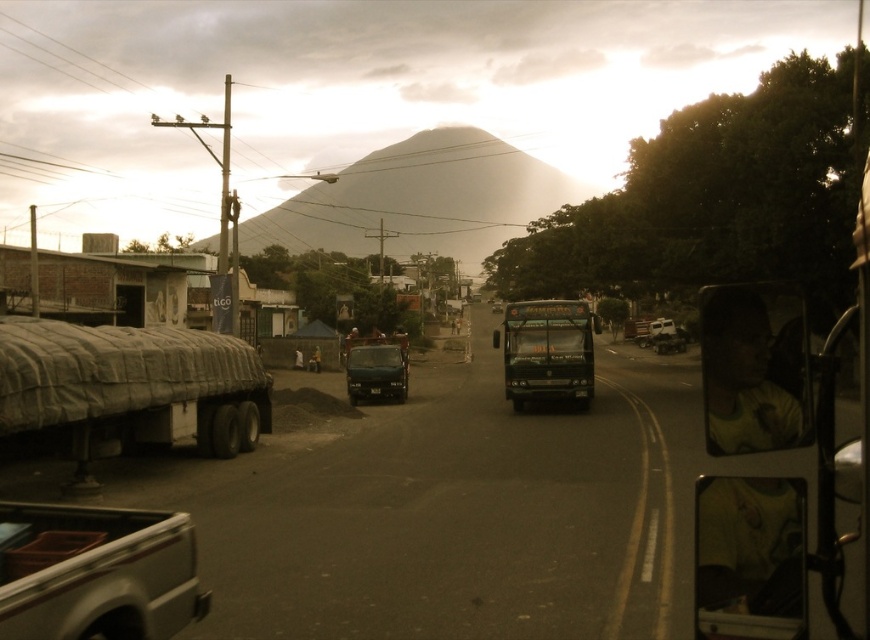
You are a delivery driver who needs to park your vehicle in a tight space between the white matte truck at lower left and the matte black truck at center. Based on their sizes, which truck should you avoid parking next to to ensure enough clearance?

The white matte truck at lower left is not as tall as the matte black truck at center, so you should avoid parking next to the matte black truck at center to ensure enough clearance because it is taller.

You are a pedestrian standing on the sidewalk next to the textured gray tarpaulin at left. You want to cross the street to reach the matte black van at center. Is the distance between them sufficient for you to comfortably walk straight there without needing to detour around any obstacles?

The distance between the textured gray tarpaulin at left and the matte black van at center is 13.99 meters, which is more than enough for a pedestrian to comfortably walk straight to the van without needing to detour around obstacles.

You are a pedestrian standing on the sidewalk and want to cross the street to reach the matte black van at center. There is a textured gray tarpaulin at left blocking your path. Can you walk around it without crossing the road?

The textured gray tarpaulin at left is closer to the viewer than the matte black van at center, so you can walk around it to reach the matte black van at center without crossing the road.